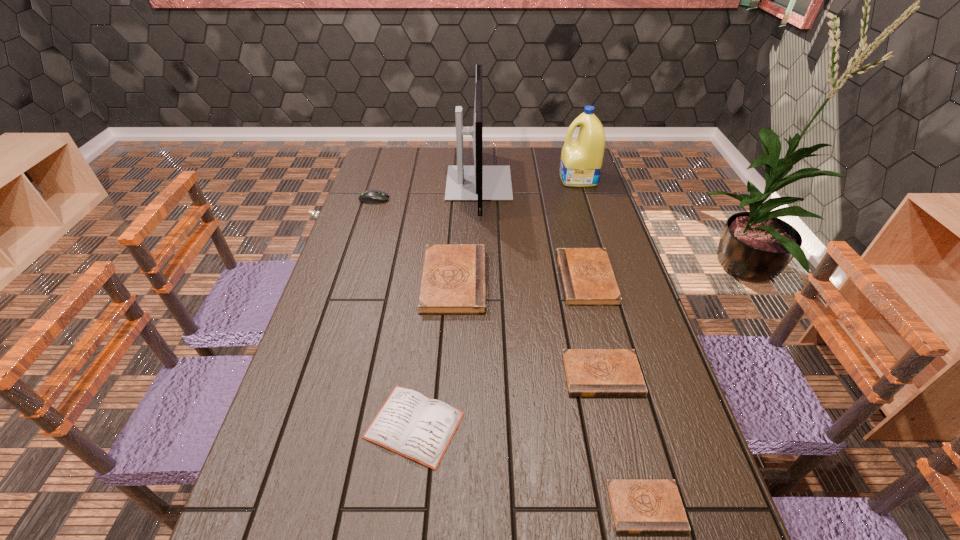
Where is `vacant region at the left edge`? The width and height of the screenshot is (960, 540). vacant region at the left edge is located at coordinates pyautogui.click(x=338, y=309).

Locate an element on the screen. This screenshot has width=960, height=540. vacant space at the right edge is located at coordinates (638, 329).

Where is `free space between the white diary and the fourth shortest object`? free space between the white diary and the fourth shortest object is located at coordinates (500, 352).

Where is `free spot between the tallest object and the seventh shortest object`? free spot between the tallest object and the seventh shortest object is located at coordinates (529, 181).

Locate an element on the screen. This screenshot has width=960, height=540. vacant space that is in between the computer monitor and the fourth shortest object is located at coordinates [x=533, y=231].

Locate an element on the screen. free space between the detergent and the second biggest brown diary is located at coordinates (582, 228).

This screenshot has width=960, height=540. I want to click on vacant region between the white diary and the gray computer mouse, so click(x=395, y=312).

You are a GUI agent. You are given a task and a screenshot of the screen. Output one action in this format:
    pyautogui.click(x=<x>, y=<y>)
    Task: Click on the vacant area that lies between the white diary and the leftmost brown diary
    
    Given the screenshot: What is the action you would take?
    pyautogui.click(x=434, y=353)

Locate an element on the screen. Image resolution: width=960 pixels, height=540 pixels. the third closest object to the computer monitor is located at coordinates (372, 196).

Locate which object is the second closest to the nearest diary. Please provide its 2D coordinates. Your answer should be formatted as a tuple, i.e. [(x, y)], where the tuple contains the x and y coordinates of a point satisfying the conditions above.

[(412, 425)]